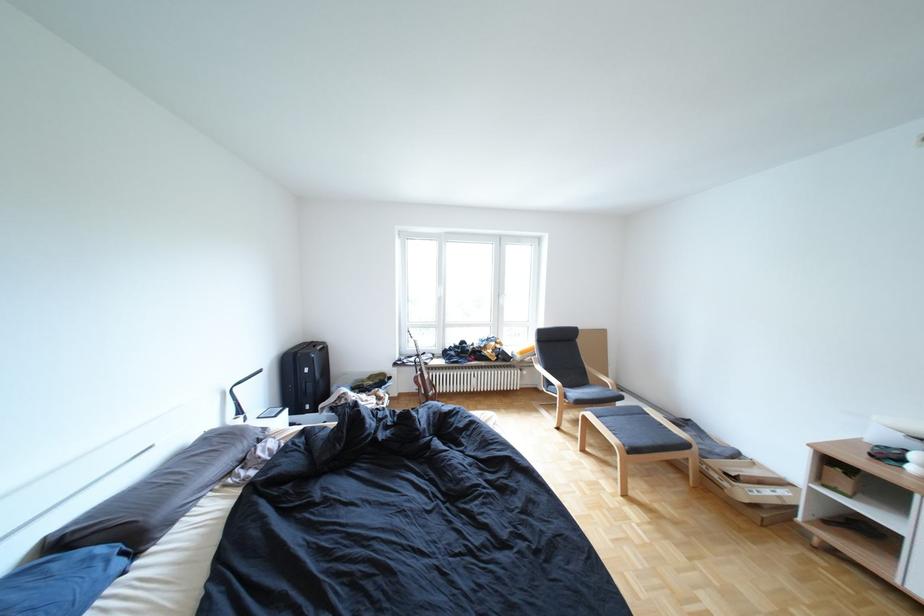
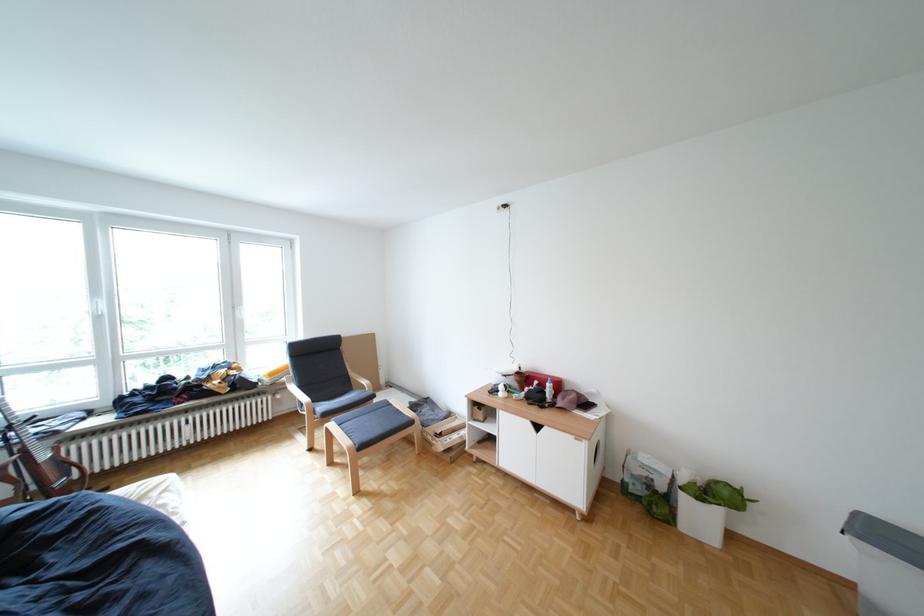
The point at (442, 377) is marked in the first image. Where is the corresponding point in the second image?

(59, 458)